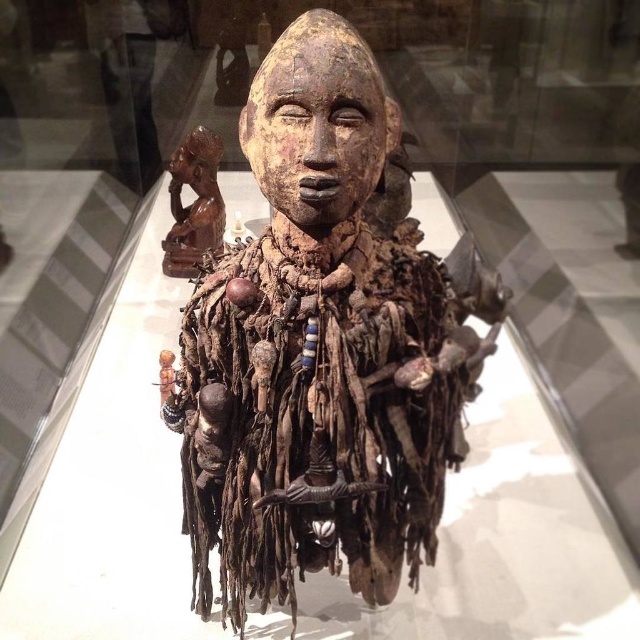
Measure the distance between point (236, 246) and camera.

1.72 meters

Who is positioned more to the left, wooden figure at center or matte brown wooden head at upper left?

From the viewer's perspective, matte brown wooden head at upper left appears more on the left side.

Measure the distance between wooden figure at center and camera.

wooden figure at center is 4.41 feet from camera.

Find the location of a particular element. The width and height of the screenshot is (640, 640). wooden figure at center is located at coordinates (323, 348).

Is wooden carved head at center smaller than matte brown wooden head at upper left?

Incorrect, wooden carved head at center is not smaller in size than matte brown wooden head at upper left.

Is wooden carved head at center to the right of matte brown wooden head at upper left from the viewer's perspective?

Yes, wooden carved head at center is to the right of matte brown wooden head at upper left.

What are the coordinates of `wooden carved head at center` in the screenshot? It's located at (323, 125).

This screenshot has height=640, width=640. I want to click on wooden carved head at center, so click(323, 125).

Does wooden figure at center have a greater width compared to brown wooden figurine at upper left?

Yes, wooden figure at center is wider than brown wooden figurine at upper left.

Can you confirm if wooden figure at center is positioned below brown wooden figurine at upper left?

Yes.

Between point (348, 513) and point (198, 182), which one is positioned behind?

Positioned behind is point (198, 182).

This screenshot has height=640, width=640. I want to click on wooden figure at center, so click(323, 348).